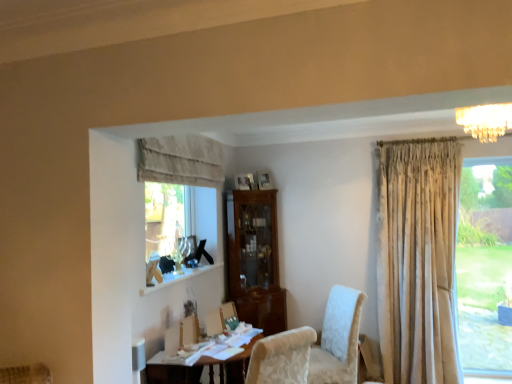
Find the location of `wooden table at lower center`. wooden table at lower center is located at coordinates (200, 369).

You are a GUI agent. You are given a task and a screenshot of the screen. Output one action in this format:
    pyautogui.click(x=<x>, y=<y>)
    Task: Click on the neutral fabric curtain at upper center
    This screenshot has height=384, width=512.
    Given the screenshot: What is the action you would take?
    [181, 160]

Locate an element on the screen. The width and height of the screenshot is (512, 384). white textured chair at center is located at coordinates (338, 339).

Considering their positions, is white textured chair at center located in front of or behind neutral fabric curtain at upper center?

Visually, white textured chair at center is located behind neutral fabric curtain at upper center.

Can we say white textured chair at center lies outside neutral fabric curtain at upper center?

Yes.

Is white textured chair at center positioned with its back to neutral fabric curtain at upper center?

white textured chair at center is not turned away from neutral fabric curtain at upper center.

Considering the positions of points (202, 164) and (169, 381), is point (202, 164) farther from camera compared to point (169, 381)?

Yes, point (202, 164) is farther from viewer.

Considering the relative sizes of neutral fabric curtain at upper center and wooden table at lower center in the image provided, is neutral fabric curtain at upper center taller than wooden table at lower center?

No, neutral fabric curtain at upper center is not taller than wooden table at lower center.

Does neutral fabric curtain at upper center lie in front of wooden table at lower center?

No, it is behind wooden table at lower center.

From the image's perspective, which is below, wooden table at lower center or neutral fabric curtain at upper center?

wooden table at lower center, from the image's perspective.

From a real-world perspective, is wooden table at lower center under neutral fabric curtain at upper center?

Indeed, from a real-world perspective, wooden table at lower center is positioned beneath neutral fabric curtain at upper center.

Is wooden table at lower center positioned with its back to neutral fabric curtain at upper center?

That's not correct — wooden table at lower center is not looking away from neutral fabric curtain at upper center.

In terms of width, does wooden table at lower center look wider or thinner when compared to neutral fabric curtain at upper center?

Considering their sizes, wooden table at lower center looks broader than neutral fabric curtain at upper center.

From the image's perspective, is white textured chair at center over wooden table at lower center?

Yes.

Considering the relative sizes of white textured chair at center and wooden table at lower center in the image provided, is white textured chair at center thinner than wooden table at lower center?

Indeed, white textured chair at center has a lesser width compared to wooden table at lower center.

Between white textured chair at center and wooden table at lower center, which one has larger size?

wooden table at lower center.

The image size is (512, 384). I want to click on curtain in front of the white textured chair at center, so click(181, 160).

Which object is wider, neutral fabric curtain at upper center or white textured chair at center?

With larger width is white textured chair at center.

Is neutral fabric curtain at upper center facing away from white textured chair at center?

neutral fabric curtain at upper center does not have its back to white textured chair at center.

Is wooden table at lower center taller or shorter than white textured chair at center?

Clearly, wooden table at lower center is shorter compared to white textured chair at center.

Based on the photo, is wooden table at lower center to the right of white textured chair at center from the viewer's perspective?

In fact, wooden table at lower center is to the left of white textured chair at center.

Is wooden table at lower center turned away from white textured chair at center?

wooden table at lower center is not turned away from white textured chair at center.

Considering the sizes of objects crystal chandelier at upper right and wooden table at lower center in the image provided, who is bigger, crystal chandelier at upper right or wooden table at lower center?

Bigger between the two is wooden table at lower center.

From the image's perspective, which is below, crystal chandelier at upper right or wooden table at lower center?

wooden table at lower center appears lower in the image.

Is crystal chandelier at upper right outside of wooden table at lower center?

Absolutely, crystal chandelier at upper right is external to wooden table at lower center.

Considering the sizes of objects crystal chandelier at upper right and wooden table at lower center in the image provided, who is shorter, crystal chandelier at upper right or wooden table at lower center?

crystal chandelier at upper right is shorter.

Image resolution: width=512 pixels, height=384 pixels. Find the location of `curtain located in front of the white textured chair at center`. curtain located in front of the white textured chair at center is located at coordinates (181, 160).

This screenshot has width=512, height=384. In the image, there is a neutral fabric curtain at upper center. In order to click on table below it (from the image's perspective) in this screenshot , I will do `click(200, 369)`.

In the scene shown: When comparing their distances from neutral fabric curtain at upper center, does white textured chair at center or crystal chandelier at upper right seem further?

crystal chandelier at upper right is further to neutral fabric curtain at upper center.

Considering their positions, is white textured chair at center positioned closer to crystal chandelier at upper right than neutral fabric curtain at upper center?

white textured chair at center is closer to crystal chandelier at upper right.

From the image, which object appears to be nearer to crystal chandelier at upper right, neutral fabric curtain at upper center or white textured chair at center?

Based on the image, white textured chair at center appears to be nearer to crystal chandelier at upper right.

Based on their spatial positions, is wooden table at lower center or crystal chandelier at upper right further from neutral fabric curtain at upper center?

crystal chandelier at upper right is positioned further to the anchor neutral fabric curtain at upper center.

In the scene shown: Considering their positions, is neutral fabric curtain at upper center positioned further to white textured chair at center than crystal chandelier at upper right?

crystal chandelier at upper right is further to white textured chair at center.

Estimate the real-world distances between objects in this image. Which object is closer to white textured chair at center, wooden table at lower center or neutral fabric curtain at upper center?

wooden table at lower center.

Based on their spatial positions, is wooden table at lower center or white textured chair at center closer to neutral fabric curtain at upper center?

wooden table at lower center is closer to neutral fabric curtain at upper center.

Consider the image. Which object lies nearer to the anchor point neutral fabric curtain at upper center, crystal chandelier at upper right or wooden table at lower center?

wooden table at lower center is closer to neutral fabric curtain at upper center.

The height and width of the screenshot is (384, 512). I want to click on chair between neutral fabric curtain at upper center and crystal chandelier at upper right, so click(338, 339).

In order to click on chair between crystal chandelier at upper right and wooden table at lower center vertically in this screenshot , I will do `click(338, 339)`.

At what (x,y) coordinates should I click in order to perform the action: click on table between neutral fabric curtain at upper center and crystal chandelier at upper right from left to right. Please return your answer as a coordinate pair (x, y). This screenshot has height=384, width=512. Looking at the image, I should click on (200, 369).

Where is `chair between neutral fabric curtain at upper center and wooden table at lower center from top to bottom`? Image resolution: width=512 pixels, height=384 pixels. chair between neutral fabric curtain at upper center and wooden table at lower center from top to bottom is located at coordinates (338, 339).